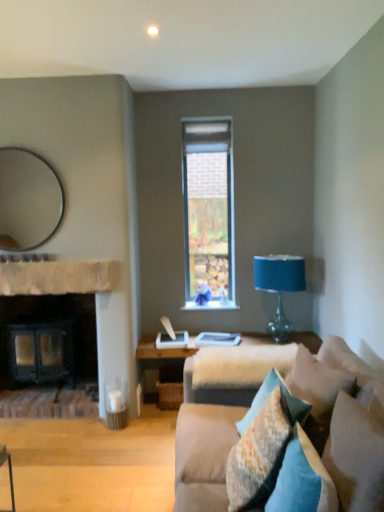
Question: Does matte silver mirror at upper left have a lesser width compared to dark wood fireplace at left?

Choices:
 (A) yes
 (B) no

Answer: (A)

Question: From a real-world perspective, is matte silver mirror at upper left over dark wood fireplace at left?

Choices:
 (A) yes
 (B) no

Answer: (A)

Question: Is matte silver mirror at upper left surrounding dark wood fireplace at left?

Choices:
 (A) yes
 (B) no

Answer: (B)

Question: Does matte silver mirror at upper left have a larger size compared to dark wood fireplace at left?

Choices:
 (A) yes
 (B) no

Answer: (B)

Question: From a real-world perspective, is matte silver mirror at upper left below dark wood fireplace at left?

Choices:
 (A) no
 (B) yes

Answer: (A)

Question: From the image's perspective, is brown stone fireplace at left positioned above or below blue glass table lamp at right?

Choices:
 (A) above
 (B) below

Answer: (A)

Question: Is brown stone fireplace at left in front of or behind blue glass table lamp at right in the image?

Choices:
 (A) behind
 (B) front

Answer: (B)

Question: Visually, is brown stone fireplace at left positioned to the left or to the right of blue glass table lamp at right?

Choices:
 (A) right
 (B) left

Answer: (B)

Question: From a real-world perspective, relative to blue glass table lamp at right, is brown stone fireplace at left vertically above or below?

Choices:
 (A) below
 (B) above

Answer: (B)

Question: In terms of size, does velvet teal pillow at lower right, which is counted as the 4th pillow, starting from the back, appear bigger or smaller than velvet beige couch at lower right?

Choices:
 (A) big
 (B) small

Answer: (B)

Question: From a real-world perspective, is velvet teal pillow at lower right, which is counted as the 4th pillow, starting from the back, above or below velvet beige couch at lower right?

Choices:
 (A) above
 (B) below

Answer: (A)

Question: Considering the positions of point (380, 474) and point (354, 361), is point (380, 474) closer or farther from the camera than point (354, 361)?

Choices:
 (A) farther
 (B) closer

Answer: (B)

Question: In the image, is velvet teal pillow at lower right, the first pillow viewed from the front, positioned in front of or behind velvet beige couch at lower right?

Choices:
 (A) front
 (B) behind

Answer: (B)

Question: From the image's perspective, is dark wood fireplace at left above or below textured beige pillow at lower right, placed as the second pillow when sorted from back to front?

Choices:
 (A) above
 (B) below

Answer: (A)

Question: Is dark wood fireplace at left inside the boundaries of textured beige pillow at lower right, marked as the 3th pillow in a front-to-back arrangement, or outside?

Choices:
 (A) outside
 (B) inside

Answer: (A)